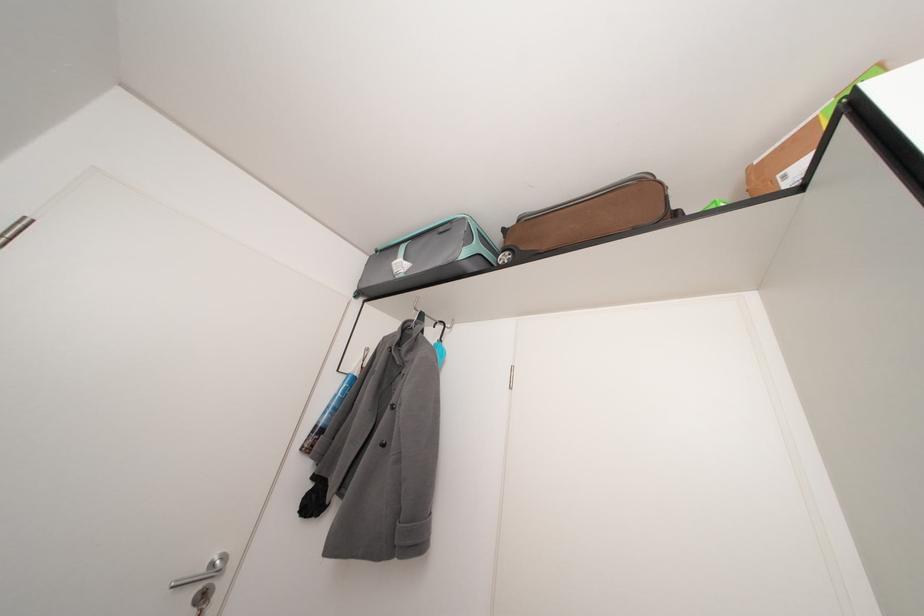
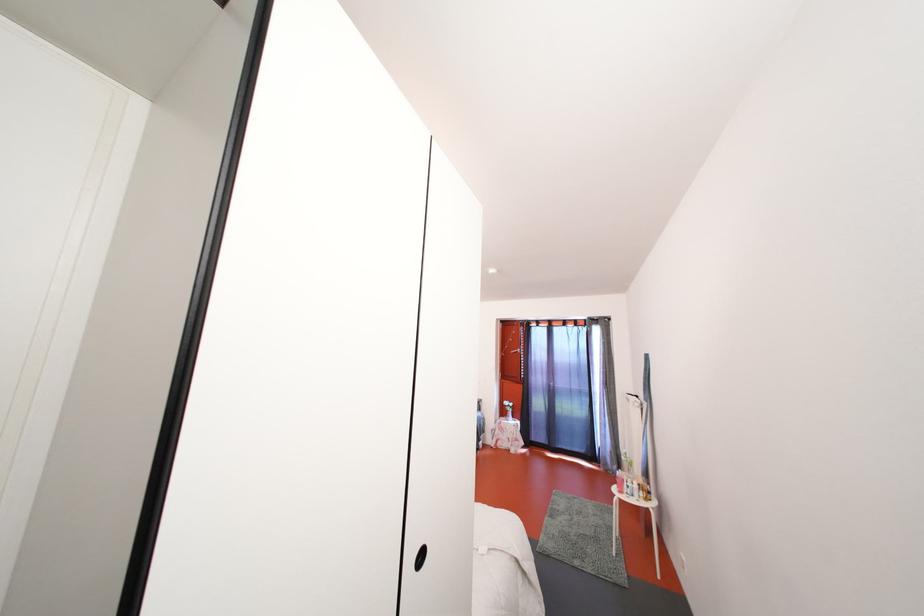
Question: Based on the continuous images, in which direction is the camera rotating? Reply with the corresponding letter.

Choices:
 (A) Left
 (B) Right
 (C) Up
 (D) Down

Answer: (B)